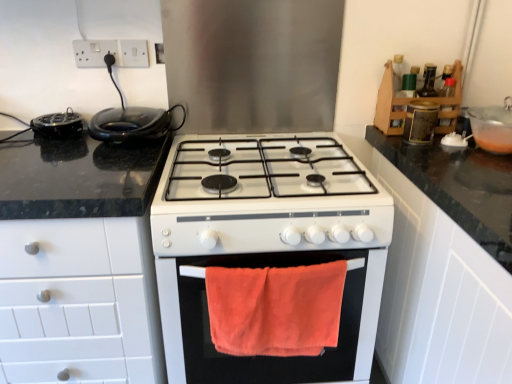
This screenshot has height=384, width=512. I want to click on translucent plastic bowl at upper right, marked as the fourth appliance in a left-to-right arrangement, so click(x=492, y=128).

The width and height of the screenshot is (512, 384). Find the location of `black glossy waffle iron at left`. black glossy waffle iron at left is located at coordinates (132, 123).

Where is `white plastic socket at upper left, which appears as the second electric outlet when viewed from the right`? white plastic socket at upper left, which appears as the second electric outlet when viewed from the right is located at coordinates (94, 52).

At what (x,y) coordinates should I click in order to perform the action: click on white plastic socket at upper center, the 1th electric outlet viewed from the right. Please return your answer as a coordinate pair (x, y). Image resolution: width=512 pixels, height=384 pixels. Looking at the image, I should click on (133, 53).

The width and height of the screenshot is (512, 384). I want to click on white glossy stove at center, marked as the first appliance in a bottom-to-top arrangement, so click(x=267, y=246).

Where is `black plastic toaster at left, the 1th appliance when ordered from left to right`? Image resolution: width=512 pixels, height=384 pixels. black plastic toaster at left, the 1th appliance when ordered from left to right is located at coordinates (57, 124).

From the image's perspective, is wooden spice rack at upper right, arranged as the first cabinetry when viewed from the top, above or below white plastic socket at upper left, which appears as the second electric outlet when viewed from the right?

wooden spice rack at upper right, arranged as the first cabinetry when viewed from the top, is situated lower than white plastic socket at upper left, which appears as the second electric outlet when viewed from the right, in the image.

Considering the positions of objects wooden spice rack at upper right, which ranks as the second cabinetry in left-to-right order, and white plastic socket at upper left, which appears as the second electric outlet when viewed from the right, in the image provided, who is in front, wooden spice rack at upper right, which ranks as the second cabinetry in left-to-right order, or white plastic socket at upper left, which appears as the second electric outlet when viewed from the right,?

wooden spice rack at upper right, which ranks as the second cabinetry in left-to-right order, is more forward.

Is there a large distance between wooden spice rack at upper right, which is the first cabinetry in right-to-left order, and white plastic socket at upper left, which appears as the second electric outlet when viewed from the right?

Absolutely, wooden spice rack at upper right, which is the first cabinetry in right-to-left order, is distant from white plastic socket at upper left, which appears as the second electric outlet when viewed from the right.

Can you tell me how much wooden spice rack at upper right, which ranks as the second cabinetry in left-to-right order, and orange towel at center differ in facing direction?

90 degrees.

Does wooden spice rack at upper right, which ranks as the second cabinetry in left-to-right order, contain orange towel at center?

Actually, orange towel at center is outside wooden spice rack at upper right, which ranks as the second cabinetry in left-to-right order.

Considering the relative sizes of wooden spice rack at upper right, arranged as the first cabinetry when viewed from the top, and orange towel at center in the image provided, is wooden spice rack at upper right, arranged as the first cabinetry when viewed from the top, thinner than orange towel at center?

No, wooden spice rack at upper right, arranged as the first cabinetry when viewed from the top, is not thinner than orange towel at center.

Is wooden spice rack at upper right, which is the first cabinetry in right-to-left order, oriented towards orange towel at center?

No, wooden spice rack at upper right, which is the first cabinetry in right-to-left order, does not turn towards orange towel at center.

Would you say white matte cabinet at left, arranged as the second cabinetry when viewed from the right, is part of white plastic socket at upper left, which is the 1th electric outlet in left-to-right order,'s contents?

No, white matte cabinet at left, arranged as the second cabinetry when viewed from the right, is not a part of white plastic socket at upper left, which is the 1th electric outlet in left-to-right order.

Is white plastic socket at upper left, which appears as the second electric outlet when viewed from the right, to the right of white matte cabinet at left, arranged as the second cabinetry when viewed from the right, from the viewer's perspective?

Correct, you'll find white plastic socket at upper left, which appears as the second electric outlet when viewed from the right, to the right of white matte cabinet at left, arranged as the second cabinetry when viewed from the right.

Which of these two, white plastic socket at upper left, which is the 1th electric outlet in left-to-right order, or white matte cabinet at left, arranged as the second cabinetry when viewed from the right, is bigger?

Bigger between the two is white matte cabinet at left, arranged as the second cabinetry when viewed from the right.

Does metallic gold canister at upper right, which is the 2th appliance from right to left, have a larger size compared to white matte cabinet at left, which is counted as the 1th cabinetry, starting from the left?

Actually, metallic gold canister at upper right, which is the 2th appliance from right to left, might be smaller than white matte cabinet at left, which is counted as the 1th cabinetry, starting from the left.

Between metallic gold canister at upper right, which is the first appliance in top-to-bottom order, and white matte cabinet at left, arranged as the second cabinetry when viewed from the right, which one has larger width?

white matte cabinet at left, arranged as the second cabinetry when viewed from the right.

From a real-world perspective, is metallic gold canister at upper right, which is the 2th appliance from right to left, located higher than white matte cabinet at left, the second cabinetry in the top-to-bottom sequence?

Indeed, from a real-world perspective, metallic gold canister at upper right, which is the 2th appliance from right to left, stands above white matte cabinet at left, the second cabinetry in the top-to-bottom sequence.

Where is `the 3rd appliance counting from the right side of the white matte cabinet at left, the second cabinetry in the top-to-bottom sequence`? The height and width of the screenshot is (384, 512). the 3rd appliance counting from the right side of the white matte cabinet at left, the second cabinetry in the top-to-bottom sequence is located at coordinates (420, 122).

Considering the relative positions of black plastic toaster at left, which is the second appliance from top to bottom, and wooden spice rack at upper right, which ranks as the second cabinetry in bottom-to-top order, in the image provided, is black plastic toaster at left, which is the second appliance from top to bottom, to the right of wooden spice rack at upper right, which ranks as the second cabinetry in bottom-to-top order, from the viewer's perspective?

In fact, black plastic toaster at left, which is the second appliance from top to bottom, is to the left of wooden spice rack at upper right, which ranks as the second cabinetry in bottom-to-top order.

Who is bigger, black plastic toaster at left, marked as the 4th appliance in a right-to-left arrangement, or wooden spice rack at upper right, which is the first cabinetry in right-to-left order?

wooden spice rack at upper right, which is the first cabinetry in right-to-left order, is bigger.

Identify the location of cabinetry behind the black plastic toaster at left, which is the third appliance in bottom-to-top order. This screenshot has height=384, width=512. (390, 105).

Relative to wooden spice rack at upper right, arranged as the first cabinetry when viewed from the top, is black plastic toaster at left, the 1th appliance when ordered from left to right, in front or behind?

black plastic toaster at left, the 1th appliance when ordered from left to right, is in front of wooden spice rack at upper right, arranged as the first cabinetry when viewed from the top.

Considering the sizes of orange towel at center and black plastic toaster at left, the 1th appliance when ordered from left to right, in the image, is orange towel at center bigger or smaller than black plastic toaster at left, the 1th appliance when ordered from left to right,?

Considering their sizes, orange towel at center takes up more space than black plastic toaster at left, the 1th appliance when ordered from left to right.

Looking at this image, from a real-world perspective, is orange towel at center located higher than black plastic toaster at left, which is the second appliance from top to bottom?

No, from a real-world perspective, orange towel at center is not above black plastic toaster at left, which is the second appliance from top to bottom.

Considering the positions of points (250, 365) and (58, 135), is point (250, 365) farther from camera compared to point (58, 135)?

No.

From their relative heights in the image, would you say orange towel at center is taller or shorter than black plastic toaster at left, marked as the 4th appliance in a right-to-left arrangement?

Clearly, orange towel at center is taller compared to black plastic toaster at left, marked as the 4th appliance in a right-to-left arrangement.

The height and width of the screenshot is (384, 512). In order to click on electric outlet that is the 2nd object above the translucent plastic bowl at upper right, the 1th appliance from the right (from a real-world perspective) in this screenshot , I will do `click(133, 53)`.

Is white plastic socket at upper center, the 1th electric outlet viewed from the right, not near translucent plastic bowl at upper right, the 1th appliance from the right?

white plastic socket at upper center, the 1th electric outlet viewed from the right, is positioned a significant distance from translucent plastic bowl at upper right, the 1th appliance from the right.

Considering the relative sizes of white plastic socket at upper center, which is the 2th electric outlet in left-to-right order, and translucent plastic bowl at upper right, marked as the fourth appliance in a left-to-right arrangement, in the image provided, is white plastic socket at upper center, which is the 2th electric outlet in left-to-right order, bigger than translucent plastic bowl at upper right, marked as the fourth appliance in a left-to-right arrangement,?

No, white plastic socket at upper center, which is the 2th electric outlet in left-to-right order, is not bigger than translucent plastic bowl at upper right, marked as the fourth appliance in a left-to-right arrangement.

From a real-world perspective, which cabinetry is the 1st one underneath the white plastic socket at upper left, which is the 1th electric outlet in left-to-right order? Please provide its 2D coordinates.

[(390, 105)]

I want to click on cabinetry that appears on the right of orange towel at center, so click(x=390, y=105).

Considering their positions, is white glossy stove at center, the 3th appliance from the right, positioned further to white matte cabinet at left, which is counted as the 1th cabinetry, starting from the left, than orange towel at center?

white glossy stove at center, the 3th appliance from the right, is positioned further to the anchor white matte cabinet at left, which is counted as the 1th cabinetry, starting from the left.

Looking at the image, which one is located closer to white plastic socket at upper left, which is the 1th electric outlet in left-to-right order, white plastic socket at upper center, which is the 2th electric outlet in left-to-right order, or wooden spice rack at upper right, which ranks as the second cabinetry in bottom-to-top order?

white plastic socket at upper center, which is the 2th electric outlet in left-to-right order, is closer to white plastic socket at upper left, which is the 1th electric outlet in left-to-right order.

Looking at the image, which one is located closer to white plastic socket at upper left, which is the 1th electric outlet in left-to-right order, translucent plastic bowl at upper right, the third appliance from the top, or black plastic toaster at left, the 1th appliance when ordered from left to right?

black plastic toaster at left, the 1th appliance when ordered from left to right, is closer to white plastic socket at upper left, which is the 1th electric outlet in left-to-right order.

Considering their positions, is translucent plastic bowl at upper right, the third appliance from the top, positioned further to white plastic socket at upper center, which is the 2th electric outlet in left-to-right order, than orange towel at center?

translucent plastic bowl at upper right, the third appliance from the top.

Based on their spatial positions, is white plastic socket at upper center, the 1th electric outlet viewed from the right, or orange towel at center further from black glossy waffle iron at left?

orange towel at center lies further to black glossy waffle iron at left than the other object.

From the image, which object appears to be farther from white plastic socket at upper center, which is the 2th electric outlet in left-to-right order, white matte cabinet at left, the second cabinetry in the top-to-bottom sequence, or black plastic toaster at left, which is the third appliance in bottom-to-top order?

The object further to white plastic socket at upper center, which is the 2th electric outlet in left-to-right order, is white matte cabinet at left, the second cabinetry in the top-to-bottom sequence.

Based on their spatial positions, is white glossy stove at center, the 3th appliance from the right, or metallic gold canister at upper right, the fourth appliance in the bottom-to-top sequence, further from white plastic socket at upper left, which is the 1th electric outlet in left-to-right order?

metallic gold canister at upper right, the fourth appliance in the bottom-to-top sequence, lies further to white plastic socket at upper left, which is the 1th electric outlet in left-to-right order, than the other object.

Looking at this image, when comparing their distances from black glossy waffle iron at left, does black plastic toaster at left, which is the second appliance from top to bottom, or wooden spice rack at upper right, which ranks as the second cabinetry in left-to-right order, seem closer?

Among the two, black plastic toaster at left, which is the second appliance from top to bottom, is located nearer to black glossy waffle iron at left.

Find the location of a particular element. This screenshot has height=384, width=512. oven between black plastic toaster at left, which is the third appliance in bottom-to-top order, and wooden spice rack at upper right, which ranks as the second cabinetry in bottom-to-top order, from left to right is located at coordinates (265, 356).

The width and height of the screenshot is (512, 384). Find the location of `kitchen appliance between black plastic toaster at left, the 1th appliance when ordered from left to right, and translucent plastic bowl at upper right, marked as the fourth appliance in a left-to-right arrangement`. kitchen appliance between black plastic toaster at left, the 1th appliance when ordered from left to right, and translucent plastic bowl at upper right, marked as the fourth appliance in a left-to-right arrangement is located at coordinates (132, 123).

The width and height of the screenshot is (512, 384). What are the coordinates of `kitchen appliance between black plastic toaster at left, which is the second appliance from top to bottom, and wooden spice rack at upper right, which ranks as the second cabinetry in bottom-to-top order, from left to right` in the screenshot? It's located at (132, 123).

Find the location of a particular element. Image resolution: width=512 pixels, height=384 pixels. electric outlet between white plastic socket at upper center, the 1th electric outlet viewed from the right, and white matte cabinet at left, the second cabinetry in the top-to-bottom sequence, vertically is located at coordinates [x=94, y=52].